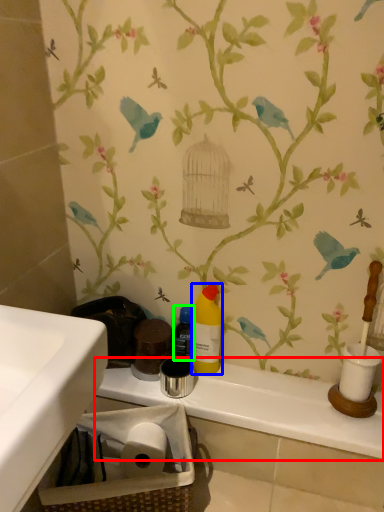
Question: Which object is positioned closest to counter top (highlighted by a red box)? Select from cleaning product (highlighted by a blue box) and bottle (highlighted by a green box).

Choices:
 (A) cleaning product
 (B) bottle

Answer: (A)